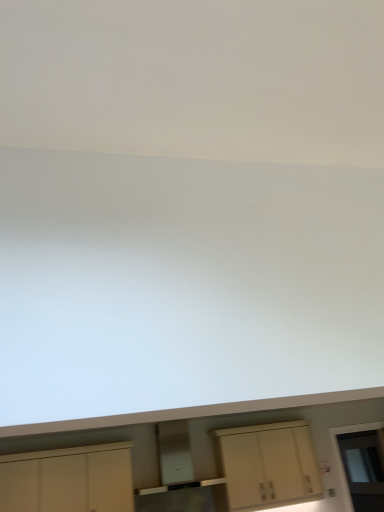
You are a GUI agent. You are given a task and a screenshot of the screen. Output one action in this format:
    pyautogui.click(x=<x>, y=<y>)
    Task: Click on the white matte cabinet at lower left, acting as the second cabinetry starting from the right
    The height and width of the screenshot is (512, 384).
    Given the screenshot: What is the action you would take?
    pyautogui.click(x=68, y=480)

Measure the distance between point (224, 429) and camera.

The depth of point (224, 429) is 5.91 meters.

Identify the location of transparent glass door at lower right. The height and width of the screenshot is (512, 384). (363, 469).

Image resolution: width=384 pixels, height=512 pixels. Identify the location of white matte cabinet at lower left, acting as the second cabinetry starting from the right. (68, 480).

From the image's perspective, which object appears higher, matte cream cabinet at center, which is counted as the first cabinetry, starting from the right, or white matte cabinet at lower left, which ranks as the 1th cabinetry in left-to-right order?

white matte cabinet at lower left, which ranks as the 1th cabinetry in left-to-right order, appears higher in the image.

Which of these two, matte cream cabinet at center, which is counted as the first cabinetry, starting from the right, or white matte cabinet at lower left, acting as the second cabinetry starting from the right, is wider?

white matte cabinet at lower left, acting as the second cabinetry starting from the right, is wider.

From a real-world perspective, between matte cream cabinet at center, the 2th cabinetry positioned from the left, and white matte cabinet at lower left, which ranks as the 1th cabinetry in left-to-right order, who is vertically lower?

matte cream cabinet at center, the 2th cabinetry positioned from the left, from a real-world perspective.

Is matte cream cabinet at center, which is counted as the first cabinetry, starting from the right, taller or shorter than white matte cabinet at lower left, which ranks as the 1th cabinetry in left-to-right order?

Clearly, matte cream cabinet at center, which is counted as the first cabinetry, starting from the right, is taller compared to white matte cabinet at lower left, which ranks as the 1th cabinetry in left-to-right order.

Based on their positions, is matte cream cabinet at center, which is counted as the first cabinetry, starting from the right, located to the left or right of transparent glass door at lower right?

Clearly, matte cream cabinet at center, which is counted as the first cabinetry, starting from the right, is on the left of transparent glass door at lower right in the image.

Which is closer to the camera, (x=221, y=460) or (x=366, y=473)?

The point (x=366, y=473) is closer to the camera.

Between matte cream cabinet at center, the 2th cabinetry positioned from the left, and transparent glass door at lower right, which one is positioned in front?

matte cream cabinet at center, the 2th cabinetry positioned from the left, is more forward.

Considering the sizes of matte cream cabinet at center, the 2th cabinetry positioned from the left, and transparent glass door at lower right in the image, is matte cream cabinet at center, the 2th cabinetry positioned from the left, wider or thinner than transparent glass door at lower right?

Result: Considering their sizes, matte cream cabinet at center, the 2th cabinetry positioned from the left, looks broader than transparent glass door at lower right.

From a real-world perspective, count 2nd cabinetrys upward from the transparent glass door at lower right and point to it. Please provide its 2D coordinates.

[(68, 480)]

Who is smaller, white matte cabinet at lower left, which ranks as the 1th cabinetry in left-to-right order, or transparent glass door at lower right?

Smaller between the two is transparent glass door at lower right.

Is white matte cabinet at lower left, acting as the second cabinetry starting from the right, oriented away from transparent glass door at lower right?

white matte cabinet at lower left, acting as the second cabinetry starting from the right, is not turned away from transparent glass door at lower right.

From a real-world perspective, between white matte cabinet at lower left, which ranks as the 1th cabinetry in left-to-right order, and transparent glass door at lower right, who is vertically higher?

white matte cabinet at lower left, which ranks as the 1th cabinetry in left-to-right order, is physically above.

From the image's perspective, which one is positioned higher, white matte cabinet at lower left, which ranks as the 1th cabinetry in left-to-right order, or matte cream cabinet at center, the 2th cabinetry positioned from the left?

white matte cabinet at lower left, which ranks as the 1th cabinetry in left-to-right order, is shown above in the image.

Can you confirm if white matte cabinet at lower left, acting as the second cabinetry starting from the right, is thinner than matte cream cabinet at center, the 2th cabinetry positioned from the left?

No.

From a real-world perspective, between white matte cabinet at lower left, acting as the second cabinetry starting from the right, and matte cream cabinet at center, the 2th cabinetry positioned from the left, who is vertically lower?

In real-world perspective, matte cream cabinet at center, the 2th cabinetry positioned from the left, is lower.

Is white matte cabinet at lower left, which ranks as the 1th cabinetry in left-to-right order, turned away from matte cream cabinet at center, the 2th cabinetry positioned from the left?

No, white matte cabinet at lower left, which ranks as the 1th cabinetry in left-to-right order, is not facing away from matte cream cabinet at center, the 2th cabinetry positioned from the left.

Considering the relative sizes of transparent glass door at lower right and matte cream cabinet at center, which is counted as the first cabinetry, starting from the right, in the image provided, is transparent glass door at lower right taller than matte cream cabinet at center, which is counted as the first cabinetry, starting from the right,?

Indeed, transparent glass door at lower right has a greater height compared to matte cream cabinet at center, which is counted as the first cabinetry, starting from the right.

Is transparent glass door at lower right smaller than matte cream cabinet at center, the 2th cabinetry positioned from the left?

Yes, transparent glass door at lower right is smaller than matte cream cabinet at center, the 2th cabinetry positioned from the left.

Choose the correct answer: Is transparent glass door at lower right inside matte cream cabinet at center, the 2th cabinetry positioned from the left, or outside it?

transparent glass door at lower right is not inside matte cream cabinet at center, the 2th cabinetry positioned from the left, it's outside.

Considering the sizes of transparent glass door at lower right and white matte cabinet at lower left, which ranks as the 1th cabinetry in left-to-right order, in the image, is transparent glass door at lower right wider or thinner than white matte cabinet at lower left, which ranks as the 1th cabinetry in left-to-right order,?

Clearly, transparent glass door at lower right has less width compared to white matte cabinet at lower left, which ranks as the 1th cabinetry in left-to-right order.

Relative to white matte cabinet at lower left, acting as the second cabinetry starting from the right, is transparent glass door at lower right in front or behind?

transparent glass door at lower right is positioned farther from the viewer than white matte cabinet at lower left, acting as the second cabinetry starting from the right.

Considering the positions of objects transparent glass door at lower right and white matte cabinet at lower left, acting as the second cabinetry starting from the right, in the image provided, who is more to the right, transparent glass door at lower right or white matte cabinet at lower left, acting as the second cabinetry starting from the right,?

transparent glass door at lower right is more to the right.

Does transparent glass door at lower right have a lesser height compared to white matte cabinet at lower left, acting as the second cabinetry starting from the right?

No, transparent glass door at lower right is not shorter than white matte cabinet at lower left, acting as the second cabinetry starting from the right.

This screenshot has width=384, height=512. Find the location of `cabinetry in front of the matte cream cabinet at center, the 2th cabinetry positioned from the left`. cabinetry in front of the matte cream cabinet at center, the 2th cabinetry positioned from the left is located at coordinates (68, 480).

The width and height of the screenshot is (384, 512). What are the coordinates of `glass door behind the matte cream cabinet at center, which is counted as the first cabinetry, starting from the right` in the screenshot? It's located at (363, 469).

Considering their positions, is matte cream cabinet at center, the 2th cabinetry positioned from the left, positioned closer to transparent glass door at lower right than white matte cabinet at lower left, which ranks as the 1th cabinetry in left-to-right order?

The object closer to transparent glass door at lower right is matte cream cabinet at center, the 2th cabinetry positioned from the left.

Looking at the image, which one is located closer to transparent glass door at lower right, white matte cabinet at lower left, which ranks as the 1th cabinetry in left-to-right order, or matte cream cabinet at center, which is counted as the first cabinetry, starting from the right?

Based on the image, matte cream cabinet at center, which is counted as the first cabinetry, starting from the right, appears to be nearer to transparent glass door at lower right.

From the image, which object appears to be nearer to matte cream cabinet at center, the 2th cabinetry positioned from the left, white matte cabinet at lower left, acting as the second cabinetry starting from the right, or transparent glass door at lower right?

transparent glass door at lower right is positioned closer to the anchor matte cream cabinet at center, the 2th cabinetry positioned from the left.

Based on their spatial positions, is transparent glass door at lower right or matte cream cabinet at center, which is counted as the first cabinetry, starting from the right, further from white matte cabinet at lower left, acting as the second cabinetry starting from the right?

transparent glass door at lower right is positioned further to the anchor white matte cabinet at lower left, acting as the second cabinetry starting from the right.

Estimate the real-world distances between objects in this image. Which object is closer to white matte cabinet at lower left, acting as the second cabinetry starting from the right, matte cream cabinet at center, the 2th cabinetry positioned from the left, or transparent glass door at lower right?

matte cream cabinet at center, the 2th cabinetry positioned from the left.

From the image, which object appears to be farther from matte cream cabinet at center, which is counted as the first cabinetry, starting from the right, transparent glass door at lower right or white matte cabinet at lower left, acting as the second cabinetry starting from the right?

The object further to matte cream cabinet at center, which is counted as the first cabinetry, starting from the right, is white matte cabinet at lower left, acting as the second cabinetry starting from the right.

Find the location of a particular element. The width and height of the screenshot is (384, 512). cabinetry between white matte cabinet at lower left, which ranks as the 1th cabinetry in left-to-right order, and transparent glass door at lower right is located at coordinates click(x=268, y=464).